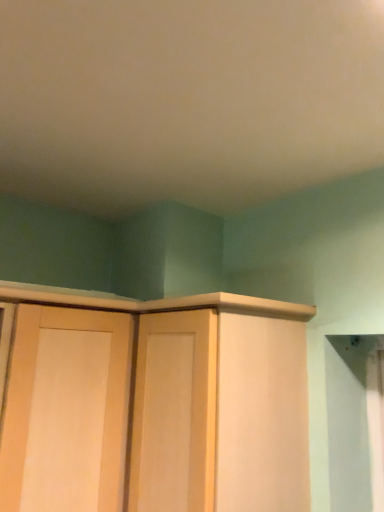
Question: Is point (39, 416) positioned closer to the camera than point (248, 442)?

Choices:
 (A) closer
 (B) farther

Answer: (B)

Question: From their relative heights in the image, would you say light wood door at center is taller or shorter than light wood cabinet at center?

Choices:
 (A) short
 (B) tall

Answer: (B)

Question: Is light wood door at center inside the boundaries of light wood cabinet at center, or outside?

Choices:
 (A) inside
 (B) outside

Answer: (B)

Question: Is point (152, 481) closer or farther from the camera than point (59, 426)?

Choices:
 (A) farther
 (B) closer

Answer: (B)

Question: Looking at the image, does light wood cabinet at center seem bigger or smaller compared to light wood door at center?

Choices:
 (A) big
 (B) small

Answer: (B)

Question: From the image's perspective, is light wood cabinet at center above or below light wood door at center?

Choices:
 (A) below
 (B) above

Answer: (B)

Question: Is light wood cabinet at center taller or shorter than light wood door at center?

Choices:
 (A) tall
 (B) short

Answer: (B)